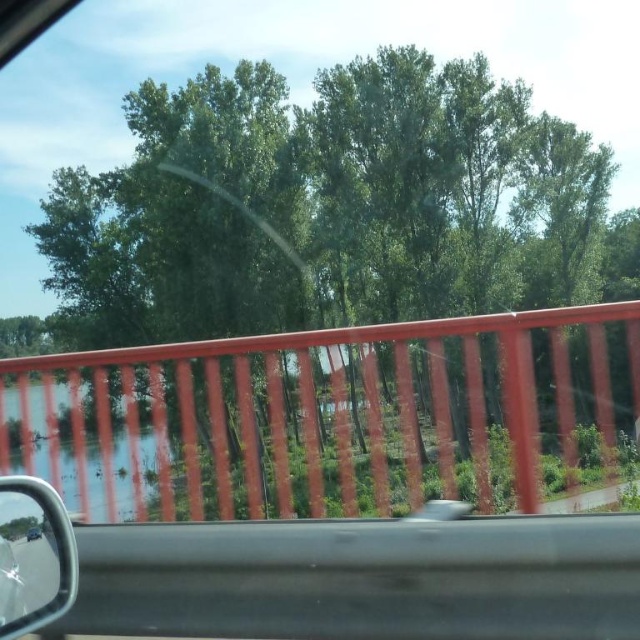
Question: Considering the relative positions of smooth orange railing at center and shiny black mirror at lower left in the image provided, where is smooth orange railing at center located with respect to shiny black mirror at lower left?

Choices:
 (A) below
 (B) above

Answer: (A)

Question: Does smooth orange railing at center have a larger size compared to shiny black mirror at lower left?

Choices:
 (A) yes
 (B) no

Answer: (A)

Question: Which point is farther from the camera taking this photo?

Choices:
 (A) (42, 595)
 (B) (200, 484)

Answer: (B)

Question: Does smooth orange railing at center have a greater width compared to shiny black mirror at lower left?

Choices:
 (A) no
 (B) yes

Answer: (B)

Question: Which of the following is the farthest from the observer?

Choices:
 (A) (42, 550)
 (B) (216, 385)

Answer: (B)